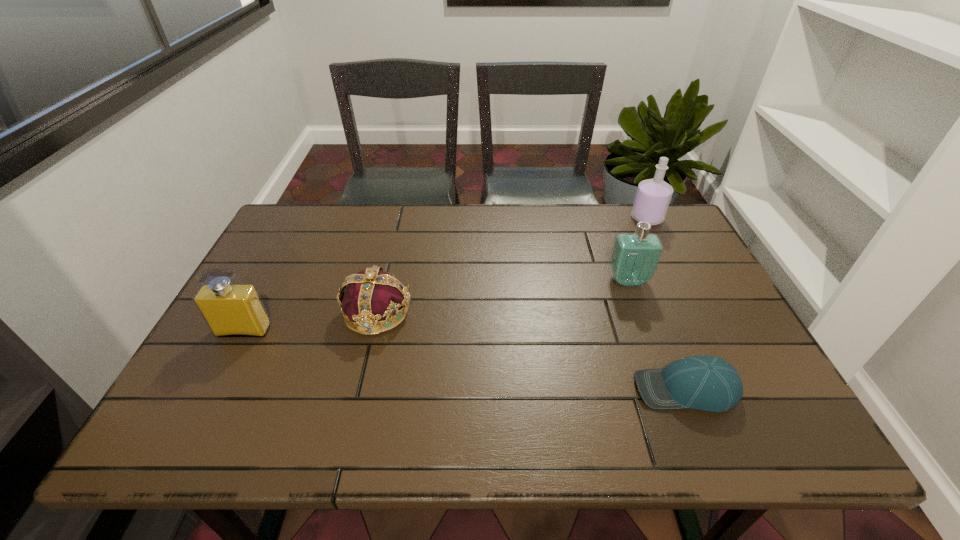
In order to click on the farthest perfume in this screenshot , I will do `click(653, 196)`.

You are a GUI agent. You are given a task and a screenshot of the screen. Output one action in this format:
    pyautogui.click(x=<x>, y=<y>)
    Task: Click on the rightmost perfume
    This screenshot has width=960, height=540.
    Given the screenshot: What is the action you would take?
    pyautogui.click(x=653, y=196)

Image resolution: width=960 pixels, height=540 pixels. Identify the location of the second nearest perfume. (634, 259).

You are a GUI agent. You are given a task and a screenshot of the screen. Output one action in this format:
    pyautogui.click(x=<x>, y=<y>)
    Task: Click on the leftmost object
    This screenshot has width=960, height=540.
    Given the screenshot: What is the action you would take?
    [229, 309]

What are the coordinates of `the leftmost perfume` in the screenshot? It's located at (229, 309).

I want to click on crown, so click(372, 295).

At what (x,y) coordinates should I click in order to perform the action: click on the fourth tallest object. Please return your answer as a coordinate pair (x, y). Image resolution: width=960 pixels, height=540 pixels. Looking at the image, I should click on (372, 295).

Where is `baseball cap`? The width and height of the screenshot is (960, 540). baseball cap is located at coordinates (707, 383).

In order to click on the nearest object in this screenshot , I will do `click(707, 383)`.

What are the coordinates of `free space located on the front label of the second nearest perfume` in the screenshot? It's located at (681, 424).